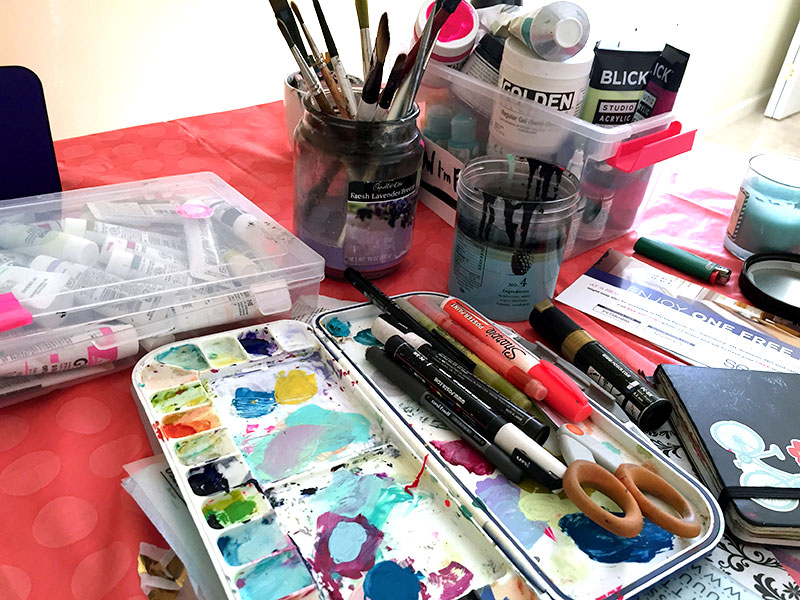
In order to click on green candle used in this screenshot , I will do `click(766, 226)`.